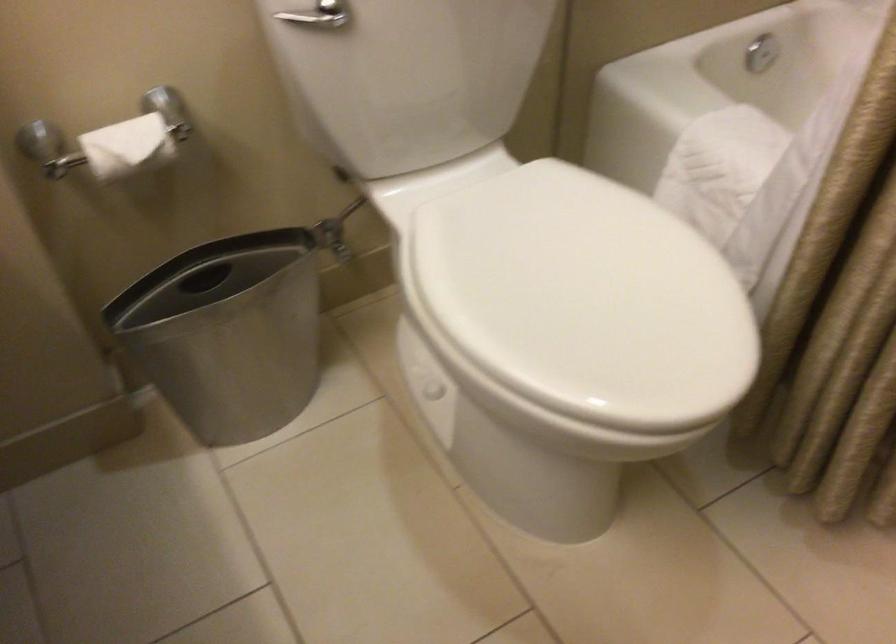
This screenshot has width=896, height=644. What do you see at coordinates (228, 333) in the screenshot?
I see `a trash can pedal` at bounding box center [228, 333].